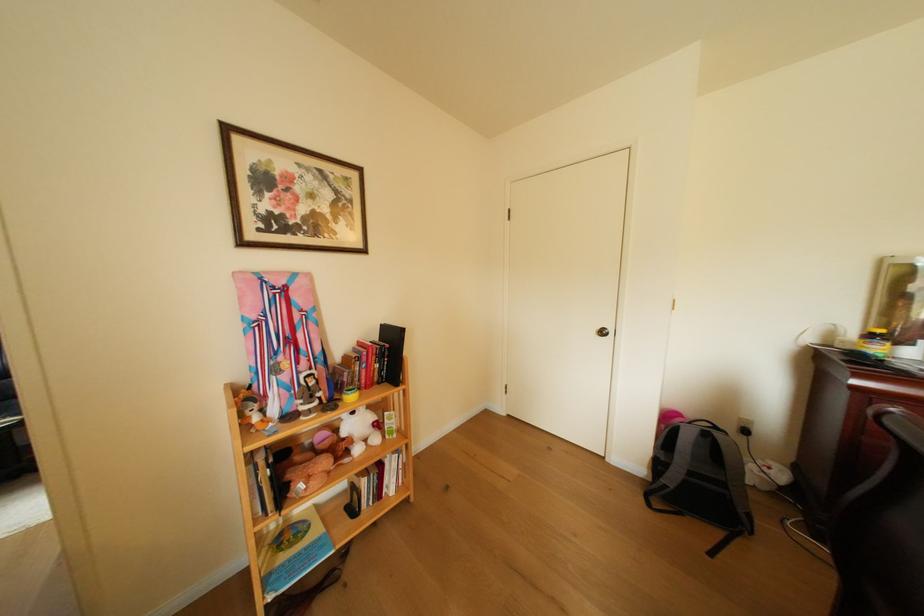
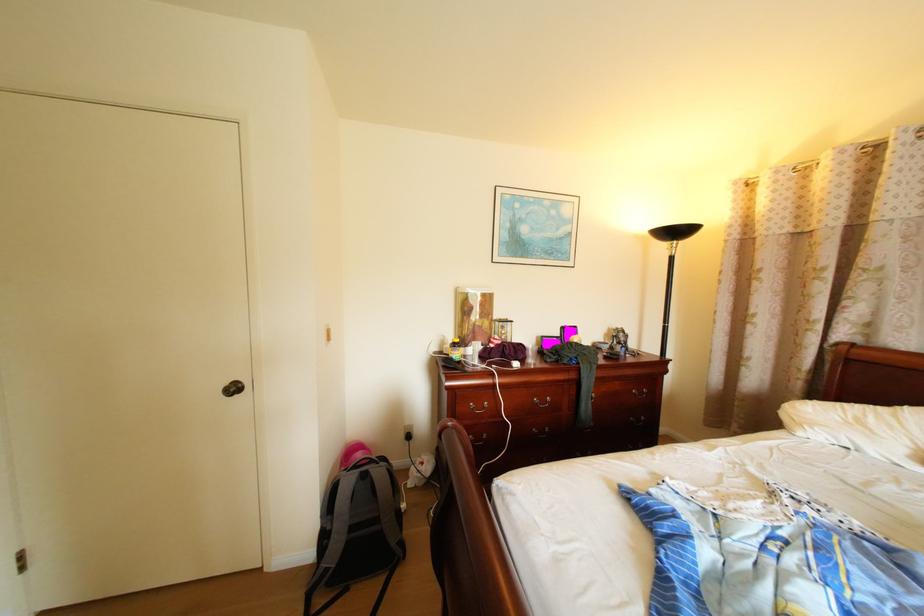
The point at (844, 336) is marked in the first image. Where is the corresponding point in the second image?

(456, 345)